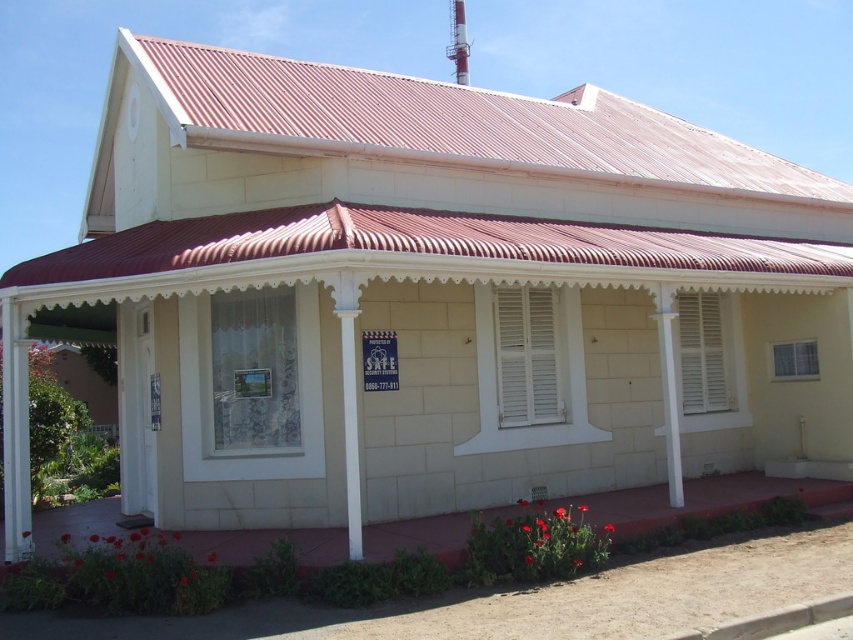
Can you confirm if red concrete porch at lower center is shorter than white wooden shutters at center?

Correct, red concrete porch at lower center is not as tall as white wooden shutters at center.

Is point (709, 486) behind point (718, 374)?

No, it is not.

Who is more distant from viewer, [86,513] or [686,321]?

Point [686,321]

Where is `red concrete porch at lower center`? red concrete porch at lower center is located at coordinates (701, 499).

Between white matte shutter at center and white wooden shutters at center, which one has less height?

Standing shorter between the two is white matte shutter at center.

Can you confirm if white matte shutter at center is thinner than white wooden shutters at center?

Yes.

Between point (512, 321) and point (692, 404), which one is positioned behind?

The point (692, 404) is more distant.

Find the location of a particular element. This screenshot has width=853, height=640. white matte shutter at center is located at coordinates (526, 356).

Does point (593, 497) come behind point (555, 317)?

No, (593, 497) is closer to viewer.

Does red concrete porch at lower center have a greater width compared to white matte shutter at center?

Indeed, red concrete porch at lower center has a greater width compared to white matte shutter at center.

Is point (369, 545) farther from viewer compared to point (514, 298)?

No, (369, 545) is in front of (514, 298).

Where is `red concrete porch at lower center`? The height and width of the screenshot is (640, 853). red concrete porch at lower center is located at coordinates (701, 499).